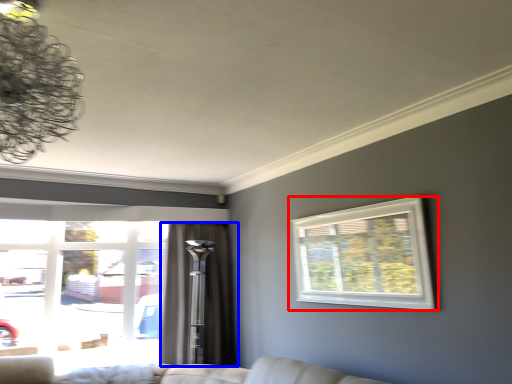
Question: Which object is further to the camera taking this photo, window (highlighted by a red box) or curtain (highlighted by a blue box)?

Choices:
 (A) window
 (B) curtain

Answer: (B)